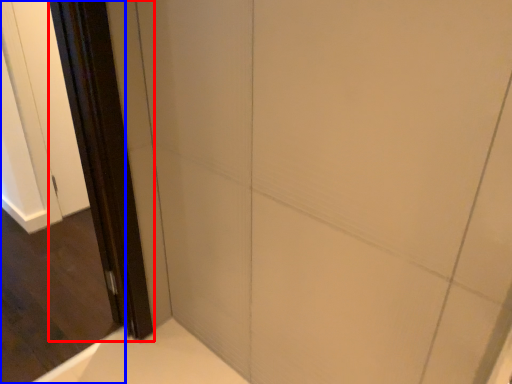
Question: Among these objects, which one is nearest to the camera, screen door (highlighted by a red box) or screen door (highlighted by a blue box)?

Choices:
 (A) screen door
 (B) screen door

Answer: (B)